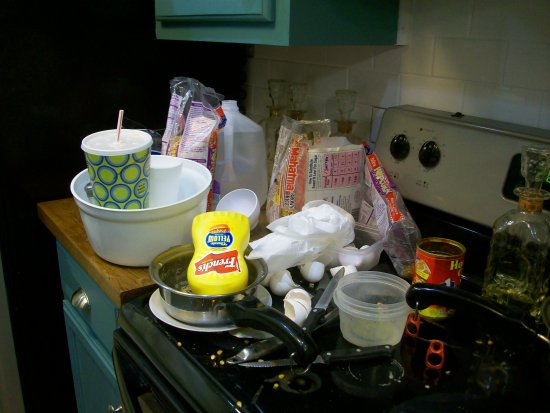
The height and width of the screenshot is (413, 550). In order to click on plastic container in this screenshot , I will do `click(372, 314)`.